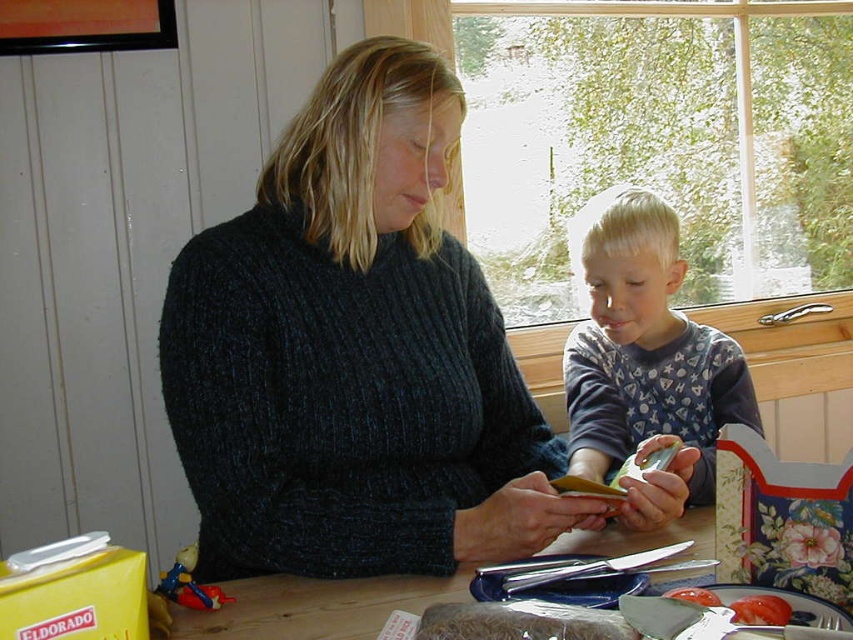
Who is positioned more to the left, dark blue knitted sweater at center or smooth tomato at lower right?

From the viewer's perspective, dark blue knitted sweater at center appears more on the left side.

Does dark blue knitted sweater at center have a larger size compared to smooth tomato at lower right?

Yes, dark blue knitted sweater at center is bigger than smooth tomato at lower right.

Who is more forward, (399, 177) or (785, 621)?

Point (785, 621) is more forward.

Where is `dark blue knitted sweater at center`? dark blue knitted sweater at center is located at coordinates (355, 353).

Can you confirm if dark blue knitted sweater at center is bigger than tomatosmoothfood at right?

Correct, dark blue knitted sweater at center is larger in size than tomatosmoothfood at right.

How distant is dark blue knitted sweater at center from tomatosmoothfood at right?

They are 17.92 inches apart.

Between point (399, 388) and point (703, 604), which one is positioned in front?

Positioned in front is point (703, 604).

Identify the location of dark blue knitted sweater at center. (355, 353).

Between point (683, 262) and point (675, 588), which one is positioned behind?

The point (683, 262) is more distant.

Does point (606, 451) lie behind point (672, 589)?

Yes, it is behind point (672, 589).

Between point (668, 257) and point (683, 592), which one is positioned behind?

The point (668, 257) is behind.

Find the location of a particular element. This screenshot has height=640, width=853. blue cotton shirt at center is located at coordinates (643, 348).